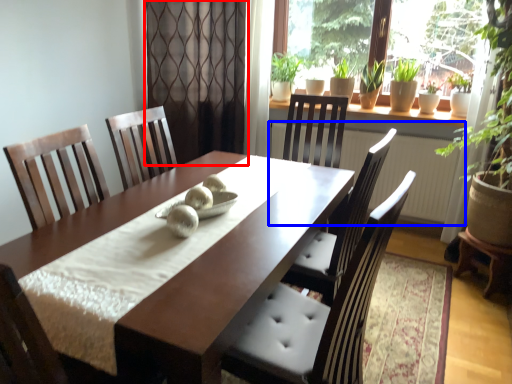
Question: Which of the following is the closest to the observer, screen door (highlighted by a red box) or radiator (highlighted by a blue box)?

Choices:
 (A) screen door
 (B) radiator

Answer: (B)